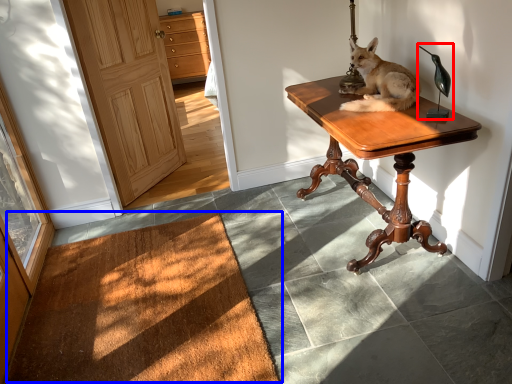
Question: Which object appears closest to the camera in this image, table lamp (highlighted by a red box) or doormat (highlighted by a blue box)?

Choices:
 (A) table lamp
 (B) doormat

Answer: (B)